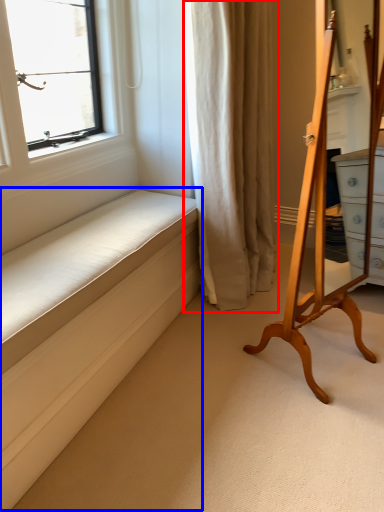
Question: Which object is closer to the camera taking this photo, curtain (highlighted by a red box) or bed frame (highlighted by a blue box)?

Choices:
 (A) curtain
 (B) bed frame

Answer: (B)